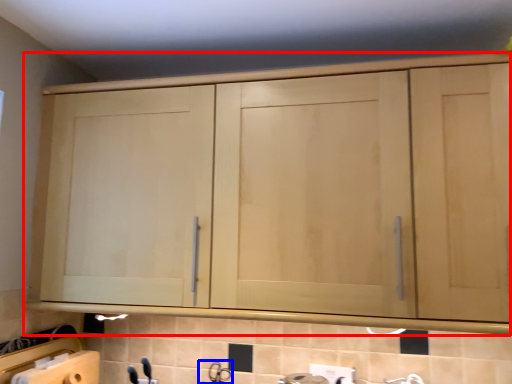
Question: Which object appears farthest to the camera in this image, cupboard (highlighted by a red box) or faucet (highlighted by a blue box)?

Choices:
 (A) cupboard
 (B) faucet

Answer: (B)